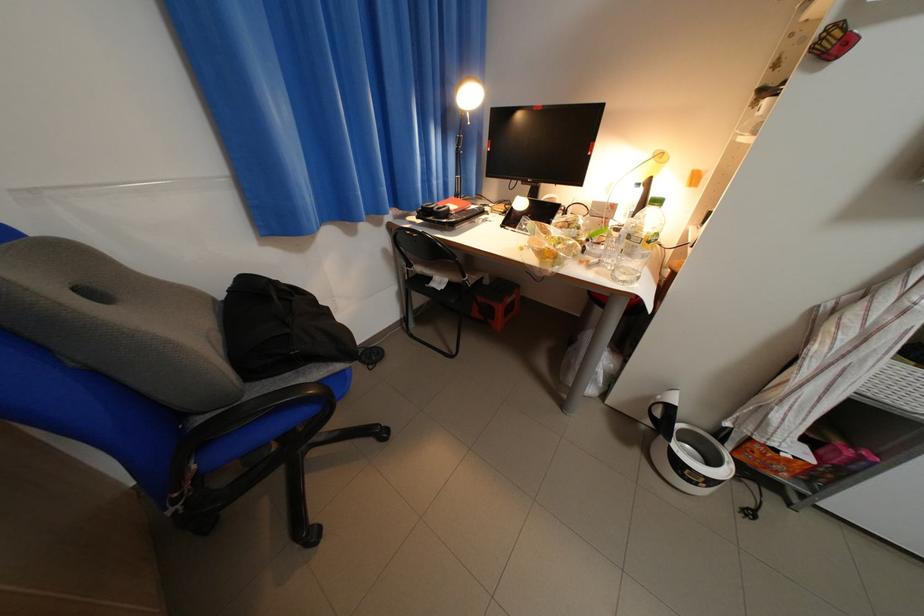
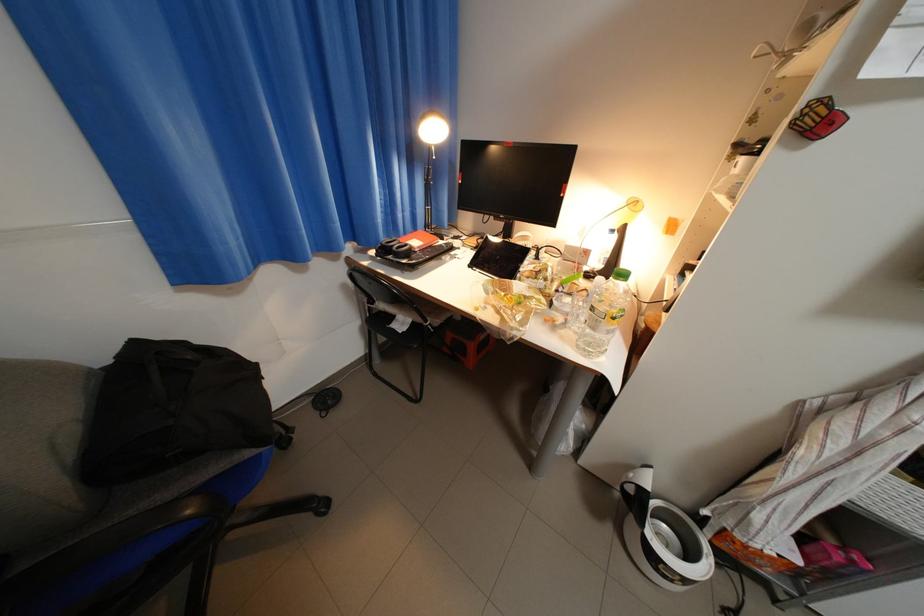
In the second image, find the point that corresponds to (641,256) in the first image.

(605, 330)